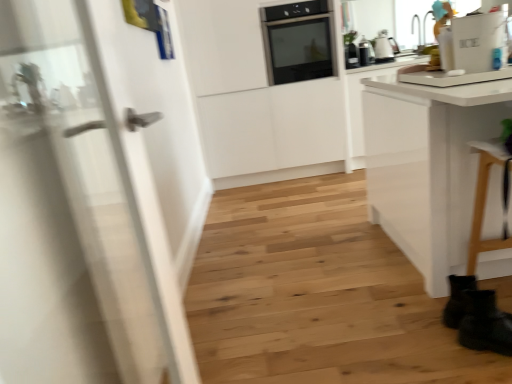
Question: Is matte silver kettle at upper right, which appears as the 1th kitchen appliance when viewed from the right, to the right of white glossy door at left from the viewer's perspective?

Choices:
 (A) no
 (B) yes

Answer: (B)

Question: Can you confirm if matte silver kettle at upper right, the second kitchen appliance when ordered from left to right, is bigger than white glossy door at left?

Choices:
 (A) yes
 (B) no

Answer: (B)

Question: Does matte silver kettle at upper right, which appears as the 1th kitchen appliance when viewed from the right, have a lesser width compared to white glossy door at left?

Choices:
 (A) no
 (B) yes

Answer: (B)

Question: From a real-world perspective, is matte silver kettle at upper right, the second kitchen appliance when ordered from left to right, located higher than white glossy door at left?

Choices:
 (A) yes
 (B) no

Answer: (A)

Question: Is matte silver kettle at upper right, which appears as the 1th kitchen appliance when viewed from the right, to the left of white glossy door at left from the viewer's perspective?

Choices:
 (A) yes
 (B) no

Answer: (B)

Question: From a real-world perspective, relative to black glossy toaster at upper right, positioned as the second kitchen appliance in right-to-left order, is black matte boot at lower right vertically above or below?

Choices:
 (A) below
 (B) above

Answer: (A)

Question: Based on their positions, is black matte boot at lower right located to the left or right of black glossy toaster at upper right, marked as the 1th kitchen appliance in a left-to-right arrangement?

Choices:
 (A) left
 (B) right

Answer: (B)

Question: Considering the positions of point (498, 329) and point (350, 66), is point (498, 329) closer or farther from the camera than point (350, 66)?

Choices:
 (A) farther
 (B) closer

Answer: (B)

Question: Do you think black matte boot at lower right is within black glossy toaster at upper right, positioned as the second kitchen appliance in right-to-left order, or outside of it?

Choices:
 (A) inside
 (B) outside

Answer: (B)

Question: Is white glossy refrigerator at upper right wider or thinner than black glossy toaster at upper right, positioned as the second kitchen appliance in right-to-left order?

Choices:
 (A) thin
 (B) wide

Answer: (A)

Question: From the image's perspective, relative to black glossy toaster at upper right, positioned as the second kitchen appliance in right-to-left order, is white glossy refrigerator at upper right above or below?

Choices:
 (A) below
 (B) above

Answer: (A)

Question: Considering the relative positions of white glossy refrigerator at upper right and black glossy toaster at upper right, marked as the 1th kitchen appliance in a left-to-right arrangement, in the image provided, is white glossy refrigerator at upper right to the left or to the right of black glossy toaster at upper right, marked as the 1th kitchen appliance in a left-to-right arrangement,?

Choices:
 (A) right
 (B) left

Answer: (A)

Question: From a real-world perspective, relative to black glossy toaster at upper right, marked as the 1th kitchen appliance in a left-to-right arrangement, is white glossy refrigerator at upper right vertically above or below?

Choices:
 (A) below
 (B) above

Answer: (B)

Question: Is black glossy toaster at upper right, positioned as the second kitchen appliance in right-to-left order, inside or outside of black matte boot at lower right?

Choices:
 (A) outside
 (B) inside

Answer: (A)

Question: Is black glossy toaster at upper right, positioned as the second kitchen appliance in right-to-left order, bigger or smaller than black matte boot at lower right?

Choices:
 (A) big
 (B) small

Answer: (B)